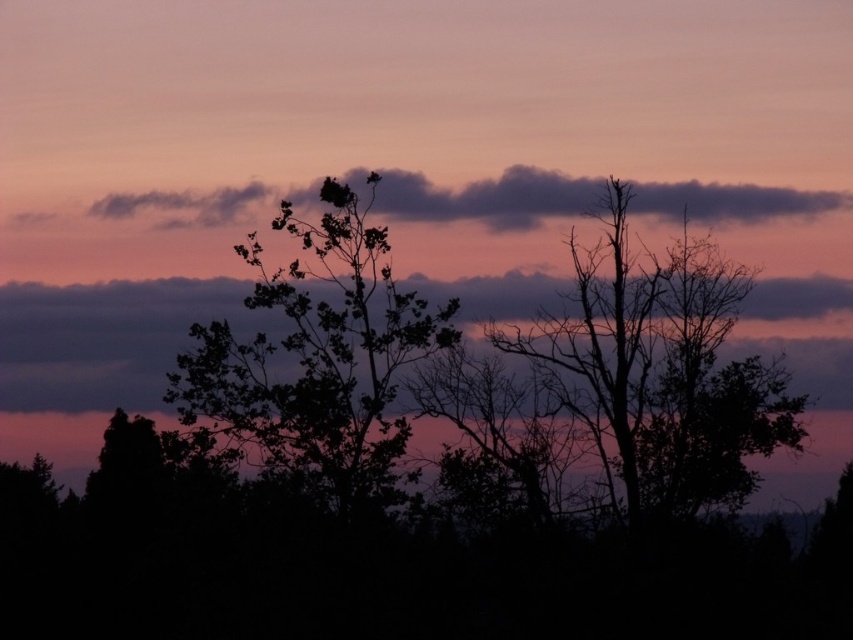
Question: Does silhouette bare tree at right appear on the left side of silhouette leafy tree at center?

Choices:
 (A) yes
 (B) no

Answer: (B)

Question: Considering the relative positions of silhouette leafy tree at center and dark purple cloud at upper center in the image provided, where is silhouette leafy tree at center located with respect to dark purple cloud at upper center?

Choices:
 (A) below
 (B) above

Answer: (A)

Question: Which point is farther from the camera taking this photo?

Choices:
 (A) (782, 392)
 (B) (753, 214)

Answer: (B)

Question: Which of the following is the farthest from the observer?

Choices:
 (A) (701, 212)
 (B) (691, 492)

Answer: (A)

Question: Does silhouette leafy tree at center lie in front of dark purple cloud at upper center?

Choices:
 (A) yes
 (B) no

Answer: (A)

Question: Estimate the real-world distances between objects in this image. Which object is farther from the silhouette leafy tree at center?

Choices:
 (A) silhouette bare tree at right
 (B) dark purple cloud at upper center

Answer: (A)